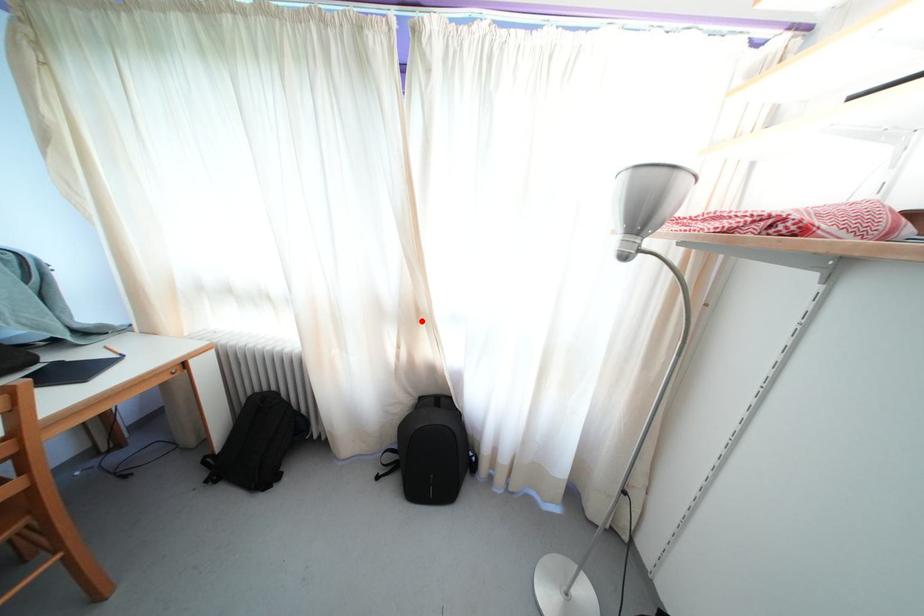
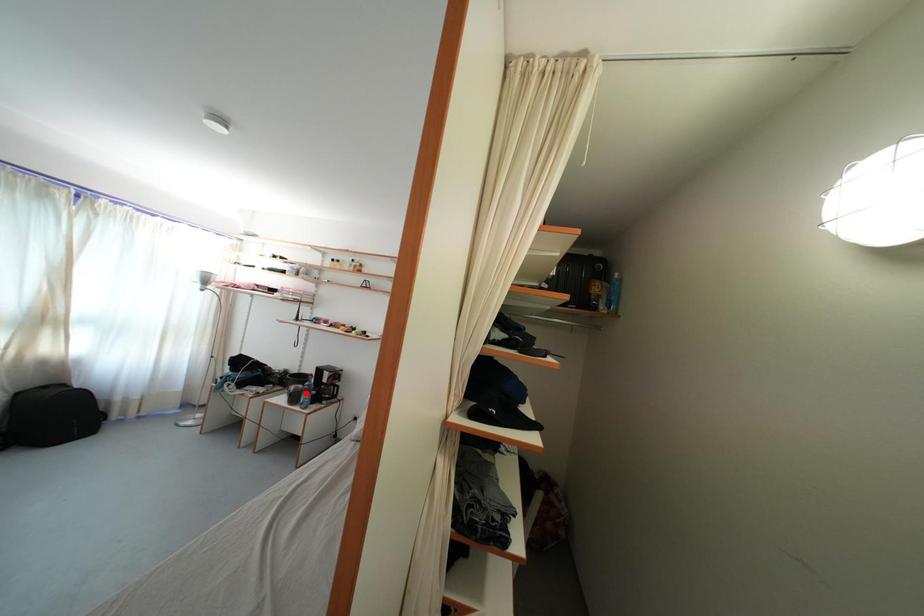
I am providing you with two images of the same scene from different viewpoints. A red point is marked on the first image and another point is marked on the second image. Is the red point in image1 aligned with the point shown in image2?

No